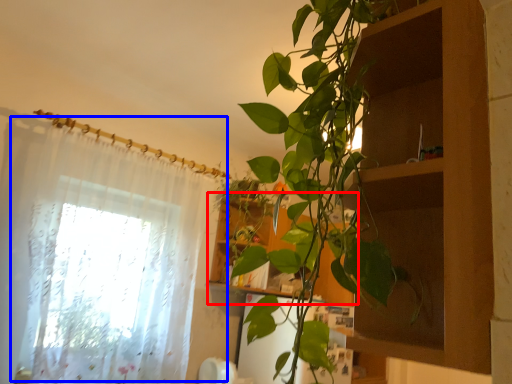
Question: Which point is further to the camera, cabinet (highlighted by a red box) or curtain (highlighted by a blue box)?

Choices:
 (A) cabinet
 (B) curtain

Answer: (A)